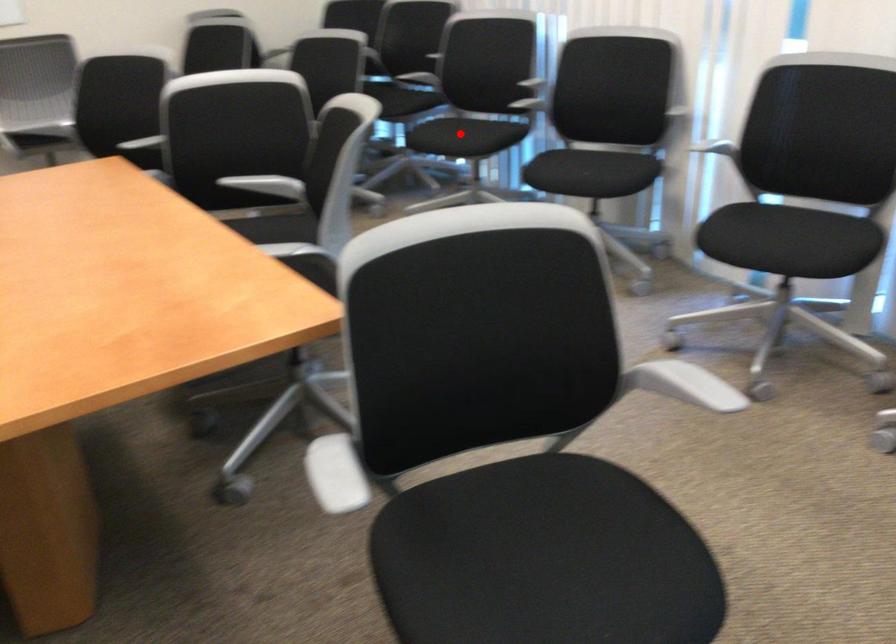
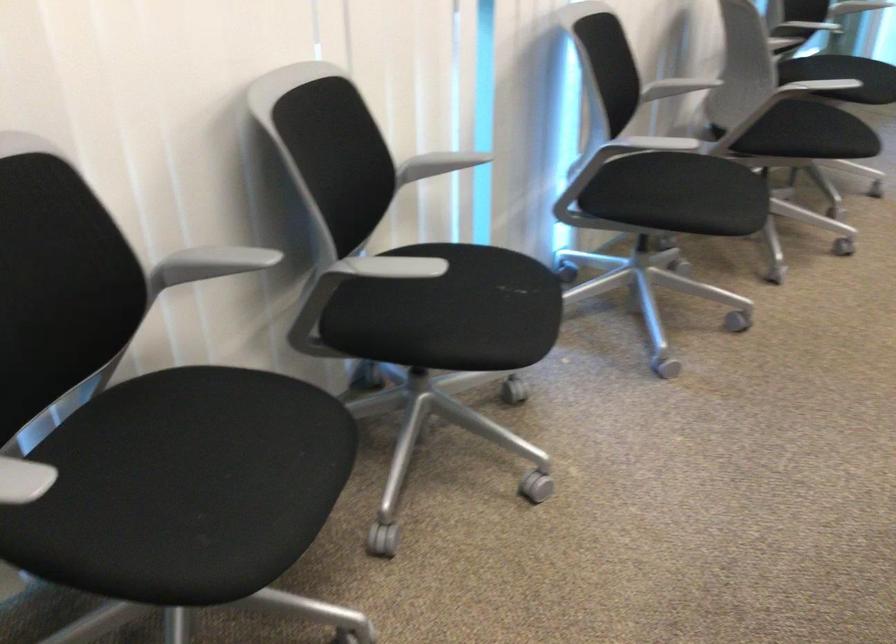
Question: I am providing you with two images of the same scene from different viewpoints. Image1 has a red point marked. In image2, the corresponding 3D location appears at what relative position? Reply with the corresponding letter.

Choices:
 (A) Closer
 (B) Farther

Answer: (A)